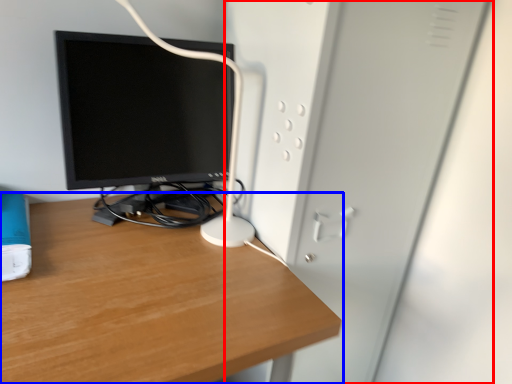
Question: Which point is further to the camera, file cabinet (highlighted by a red box) or desk (highlighted by a blue box)?

Choices:
 (A) file cabinet
 (B) desk

Answer: (A)